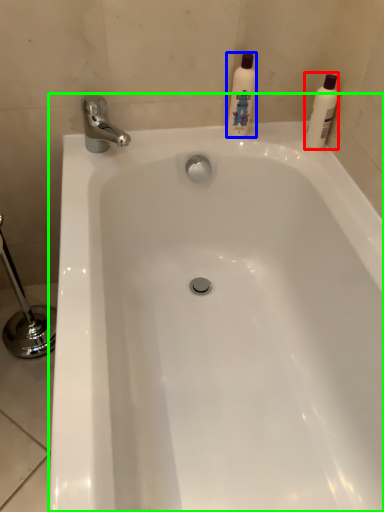
Question: Which object is the farthest from cleaning product (highlighted by a red box)? Choose among these: cleaning product (highlighted by a blue box) or bathtub (highlighted by a green box).

Choices:
 (A) cleaning product
 (B) bathtub

Answer: (B)